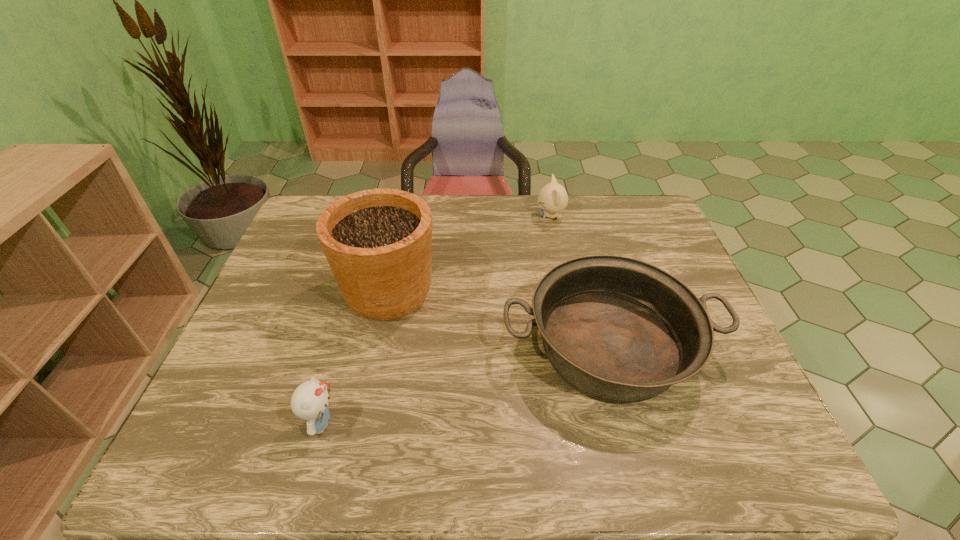
Find the location of a particular element. This screenshot has height=540, width=960. vacant space positioned 0.220m on the front-facing side of the nearer kitten is located at coordinates (441, 423).

Locate an element on the screen. This screenshot has height=540, width=960. object that is positioned at the far edge is located at coordinates (553, 198).

In order to click on object located in the near edge section of the desktop in this screenshot , I will do `click(309, 402)`.

The width and height of the screenshot is (960, 540). In order to click on object that is at the right edge in this screenshot , I will do `click(619, 329)`.

Locate an element on the screen. The height and width of the screenshot is (540, 960). vacant region at the far edge of the desktop is located at coordinates (574, 195).

Locate an element on the screen. vacant space at the right edge is located at coordinates (655, 251).

Where is `empty space that is in between the right kitten and the nearer kitten`? The image size is (960, 540). empty space that is in between the right kitten and the nearer kitten is located at coordinates (436, 320).

Identify the location of empty location between the left kitten and the tallest object. This screenshot has height=540, width=960. (354, 357).

Locate an element on the screen. free space between the farther kitten and the nearer kitten is located at coordinates (436, 320).

Where is `free space between the nearer kitten and the farther kitten`? The height and width of the screenshot is (540, 960). free space between the nearer kitten and the farther kitten is located at coordinates (436, 320).